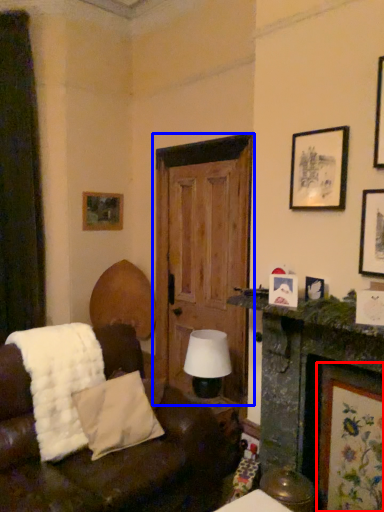
Question: Which of the following is the farthest to the observer, picture frame (highlighted by a red box) or door (highlighted by a blue box)?

Choices:
 (A) picture frame
 (B) door

Answer: (B)